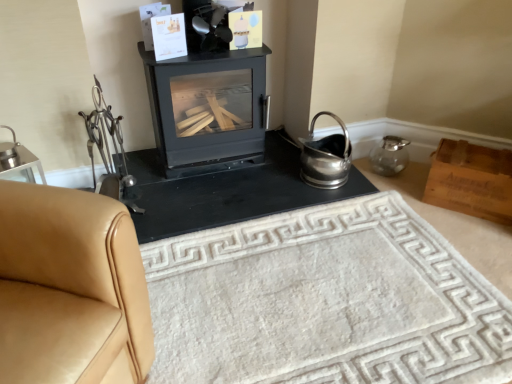
At what (x,y) coordinates should I click in order to perform the action: click on space that is in front of wooden box at right. Please return your answer as a coordinate pair (x, y). The height and width of the screenshot is (384, 512). Looking at the image, I should click on (477, 233).